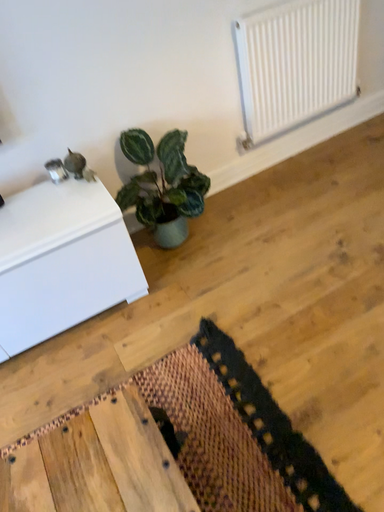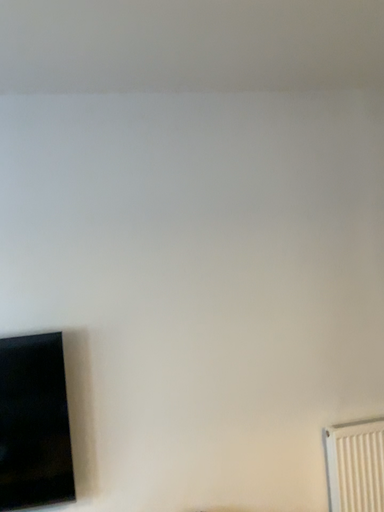
Question: How did the camera likely rotate when shooting the video?

Choices:
 (A) rotated upward
 (B) rotated downward

Answer: (A)